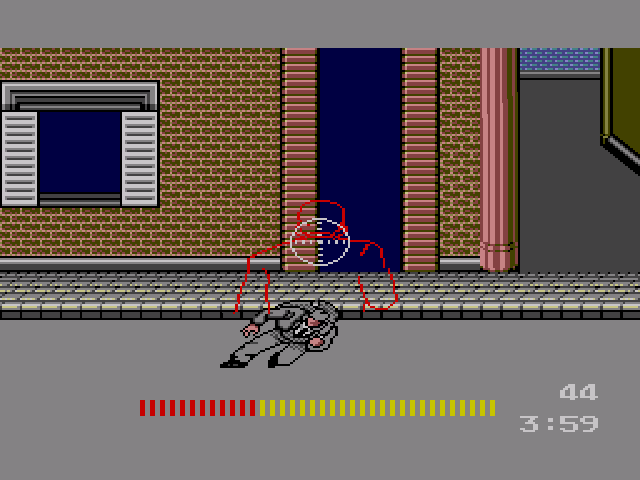
I want to click on bar, so click(x=474, y=412).